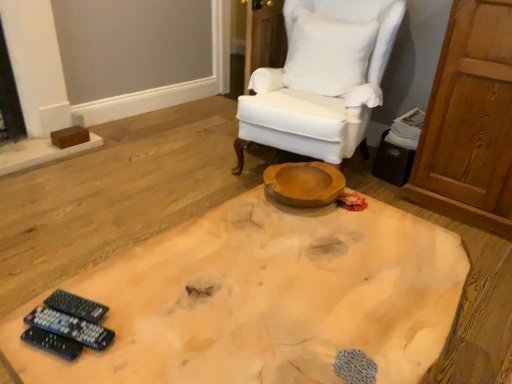
Question: Is black plastic remote controls at lower left, the 3th remote control positioned from the front, shorter than white fabric chair at upper center?

Choices:
 (A) no
 (B) yes

Answer: (B)

Question: Is black plastic remote controls at lower left, the 1th remote control viewed from the back, outside of white fabric chair at upper center?

Choices:
 (A) yes
 (B) no

Answer: (A)

Question: Is the position of black plastic remote controls at lower left, the 1th remote control viewed from the back, less distant than that of white fabric chair at upper center?

Choices:
 (A) yes
 (B) no

Answer: (A)

Question: From a real-world perspective, is black plastic remote controls at lower left, the 1th remote control viewed from the back, below white fabric chair at upper center?

Choices:
 (A) no
 (B) yes

Answer: (B)

Question: Considering the relative sizes of black plastic remote controls at lower left, the 1th remote control viewed from the back, and white fabric chair at upper center in the image provided, is black plastic remote controls at lower left, the 1th remote control viewed from the back, wider than white fabric chair at upper center?

Choices:
 (A) yes
 (B) no

Answer: (B)

Question: Can you confirm if black plastic remote controls at lower left, the 1th remote control viewed from the back, is positioned to the right of white fabric chair at upper center?

Choices:
 (A) yes
 (B) no

Answer: (B)

Question: Is black plastic remote controls at lower left, which ranks as the 3th remote control in back-to-front order, at the left side of white cotton pillow at upper right?

Choices:
 (A) no
 (B) yes

Answer: (B)

Question: Is black plastic remote controls at lower left, which ranks as the 3th remote control in back-to-front order, positioned with its back to white cotton pillow at upper right?

Choices:
 (A) no
 (B) yes

Answer: (A)

Question: Does black plastic remote controls at lower left, which ranks as the 3th remote control in back-to-front order, have a larger size compared to white cotton pillow at upper right?

Choices:
 (A) no
 (B) yes

Answer: (A)

Question: Does black plastic remote controls at lower left, arranged as the 1th remote control when viewed from the front, have a greater height compared to white cotton pillow at upper right?

Choices:
 (A) no
 (B) yes

Answer: (A)

Question: From a real-world perspective, is black plastic remote controls at lower left, arranged as the 1th remote control when viewed from the front, below white cotton pillow at upper right?

Choices:
 (A) yes
 (B) no

Answer: (A)

Question: Does black plastic remote controls at lower left, arranged as the 1th remote control when viewed from the front, lie in front of white cotton pillow at upper right?

Choices:
 (A) no
 (B) yes

Answer: (B)

Question: Is black plastic remote controls at lower left, the 1th remote control viewed from the back, at the left side of natural wood coffee table at center?

Choices:
 (A) yes
 (B) no

Answer: (A)